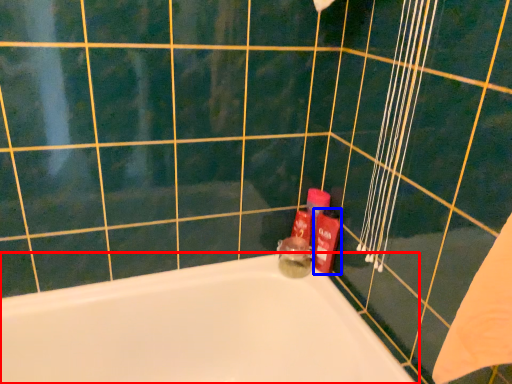
Question: Which object is closer to the camera taking this photo, bathtub (highlighted by a red box) or toiletry (highlighted by a blue box)?

Choices:
 (A) bathtub
 (B) toiletry

Answer: (A)